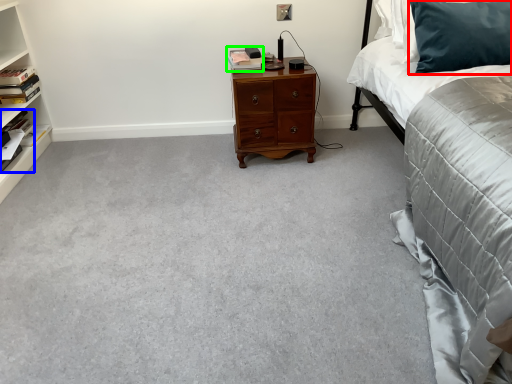
Question: Which is nearer to the pillow (highlighted by a red box)? book (highlighted by a blue box) or book (highlighted by a green box).

Choices:
 (A) book
 (B) book

Answer: (B)